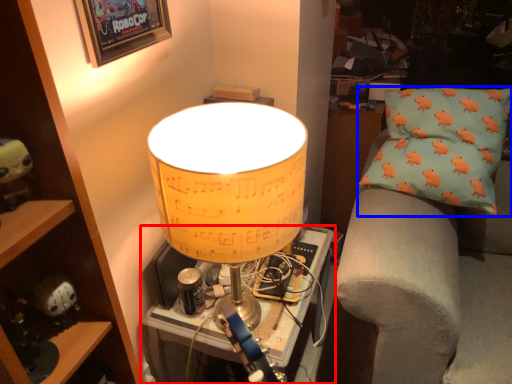
Question: Which point is further to the camera, table (highlighted by a red box) or pillow (highlighted by a blue box)?

Choices:
 (A) table
 (B) pillow

Answer: (B)